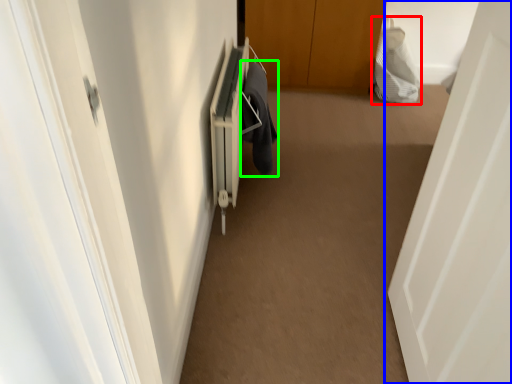
Question: Considering the real-world distances, which object is closest to material (highlighted by a red box)? door (highlighted by a blue box) or laundry (highlighted by a green box).

Choices:
 (A) door
 (B) laundry

Answer: (B)